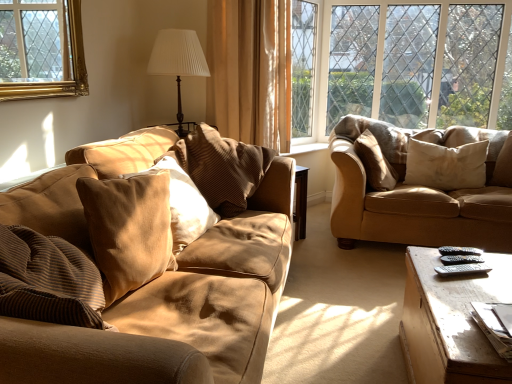
Question: Is white pleated fabric at upper center not inside brown striped pillow at center, acting as the 3th pillow starting from the right?

Choices:
 (A) yes
 (B) no

Answer: (A)

Question: Does white pleated fabric at upper center have a greater height compared to brown striped pillow at center, acting as the 3th pillow starting from the right?

Choices:
 (A) yes
 (B) no

Answer: (A)

Question: Does white pleated fabric at upper center have a lesser width compared to brown striped pillow at center, acting as the 3th pillow starting from the right?

Choices:
 (A) yes
 (B) no

Answer: (A)

Question: Is white pleated fabric at upper center wider than brown striped pillow at center, acting as the 3th pillow starting from the right?

Choices:
 (A) yes
 (B) no

Answer: (B)

Question: From the image's perspective, is white pleated fabric at upper center on top of brown striped pillow at center, acting as the 3th pillow starting from the right?

Choices:
 (A) yes
 (B) no

Answer: (A)

Question: Can brown striped pillow at center, which ranks as the 3th pillow in left-to-right order, be found inside white pleated fabric at upper center?

Choices:
 (A) no
 (B) yes

Answer: (A)

Question: From a real-world perspective, is clear glass window at upper right on top of suede-like beige pillow at right, positioned as the fourth pillow in left-to-right order?

Choices:
 (A) no
 (B) yes

Answer: (B)

Question: Does clear glass window at upper right turn towards suede-like beige pillow at right, which is the second pillow from right to left?

Choices:
 (A) yes
 (B) no

Answer: (A)

Question: From a real-world perspective, is clear glass window at upper right beneath suede-like beige pillow at right, which is the second pillow from right to left?

Choices:
 (A) yes
 (B) no

Answer: (B)

Question: Is clear glass window at upper right thinner than suede-like beige pillow at right, positioned as the fourth pillow in left-to-right order?

Choices:
 (A) no
 (B) yes

Answer: (B)

Question: Are clear glass window at upper right and suede-like beige pillow at right, which is the second pillow from right to left, located far from each other?

Choices:
 (A) yes
 (B) no

Answer: (A)

Question: Does clear glass window at upper right have a larger size compared to suede-like beige pillow at right, positioned as the fourth pillow in left-to-right order?

Choices:
 (A) no
 (B) yes

Answer: (B)

Question: From a real-world perspective, is suede-like beige pillow at right, positioned as the fourth pillow in left-to-right order, beneath brown fabric curtain at center?

Choices:
 (A) yes
 (B) no

Answer: (A)